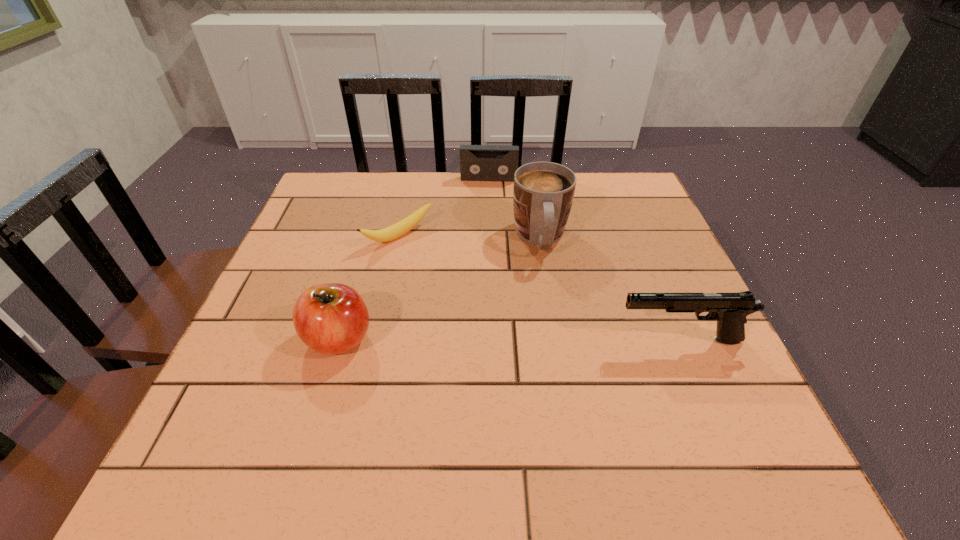
Locate an element on the screen. The image size is (960, 540). vacant space on the desktop that is between the apple and the rightmost object and is positioned on the upward curve of the banana is located at coordinates (517, 340).

I want to click on vacant space on the desktop that is between the apple and the rightmost object and is positioned on the front-facing side of the videotape, so coord(481,339).

Identify the location of free space on the desktop that is between the apple and the rightmost object and is positioned on the side of the mug with the handle. The width and height of the screenshot is (960, 540). (554, 340).